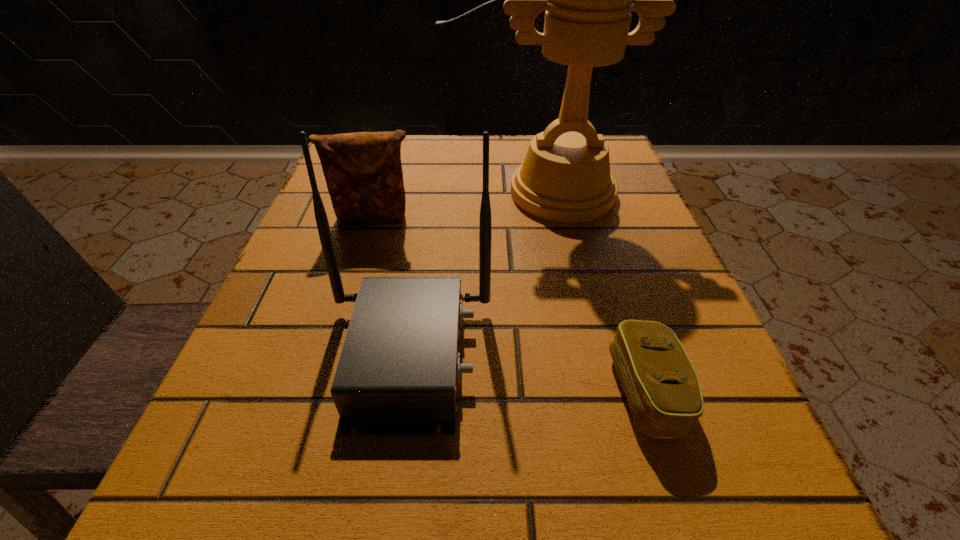
Where is `free point located 0.400m on the zipper side of the right clutch bag`? The image size is (960, 540). free point located 0.400m on the zipper side of the right clutch bag is located at coordinates (300, 392).

The width and height of the screenshot is (960, 540). I want to click on vacant space situated 0.400m on the zipper side of the right clutch bag, so click(300, 392).

Locate an element on the screen. The width and height of the screenshot is (960, 540). object that is at the far edge is located at coordinates (565, 177).

At what (x,y) coordinates should I click in order to perform the action: click on router situated at the left edge. Please return your answer as a coordinate pair (x, y). This screenshot has height=540, width=960. Looking at the image, I should click on (398, 373).

Where is `clutch bag situated at the left edge`? The image size is (960, 540). clutch bag situated at the left edge is located at coordinates (363, 171).

Find the location of a particular element. award that is at the right edge is located at coordinates (565, 177).

At what (x,y) coordinates should I click in order to perform the action: click on clutch bag present at the right edge. Please return your answer as a coordinate pair (x, y). This screenshot has width=960, height=540. Looking at the image, I should click on (661, 385).

Where is `object present at the far right corner`? object present at the far right corner is located at coordinates (565, 177).

At what (x,y) coordinates should I click in order to perform the action: click on vacant space at the far edge. Please return your answer as a coordinate pair (x, y). Looking at the image, I should click on click(x=424, y=148).

In the image, there is a desktop. Where is `vacant area at the left edge`? The width and height of the screenshot is (960, 540). vacant area at the left edge is located at coordinates (267, 333).